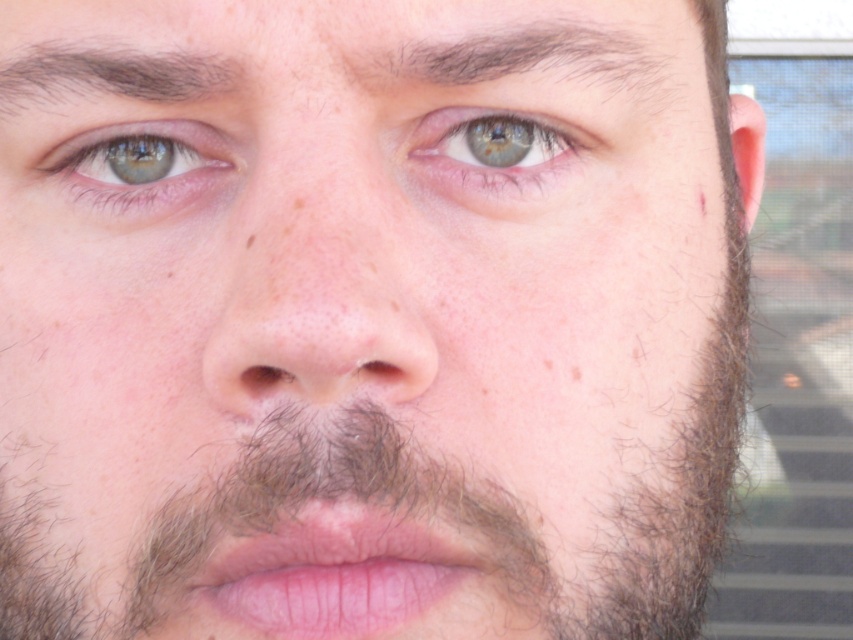
Does blue matte eye at center have a lesser width compared to dark brown hair at upper left?

Yes.

Is point (540, 170) positioned in front of point (47, 83)?

No.

The image size is (853, 640). Identify the location of blue matte eye at center. (498, 156).

Does point (305, 193) come farther from viewer compared to point (125, 147)?

No, (305, 193) is in front of (125, 147).

Who is more distant from viewer, (329, 316) or (86, 131)?

Point (86, 131)

Is point (281, 266) closer to viewer compared to point (103, 129)?

Yes, it is in front of point (103, 129).

Where is `smooth skin nose at center`? This screenshot has width=853, height=640. smooth skin nose at center is located at coordinates (318, 275).

Does smooth skin nose at center appear on the left side of dark brown hair at upper center?

Indeed, smooth skin nose at center is positioned on the left side of dark brown hair at upper center.

Which is more to the right, smooth skin nose at center or dark brown hair at upper center?

dark brown hair at upper center

The height and width of the screenshot is (640, 853). In order to click on smooth skin nose at center in this screenshot , I will do `click(318, 275)`.